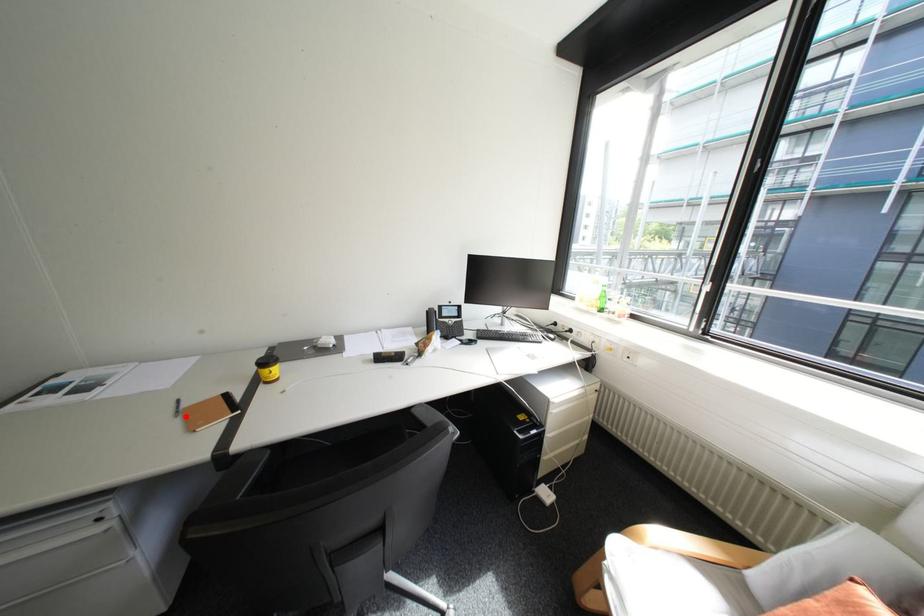
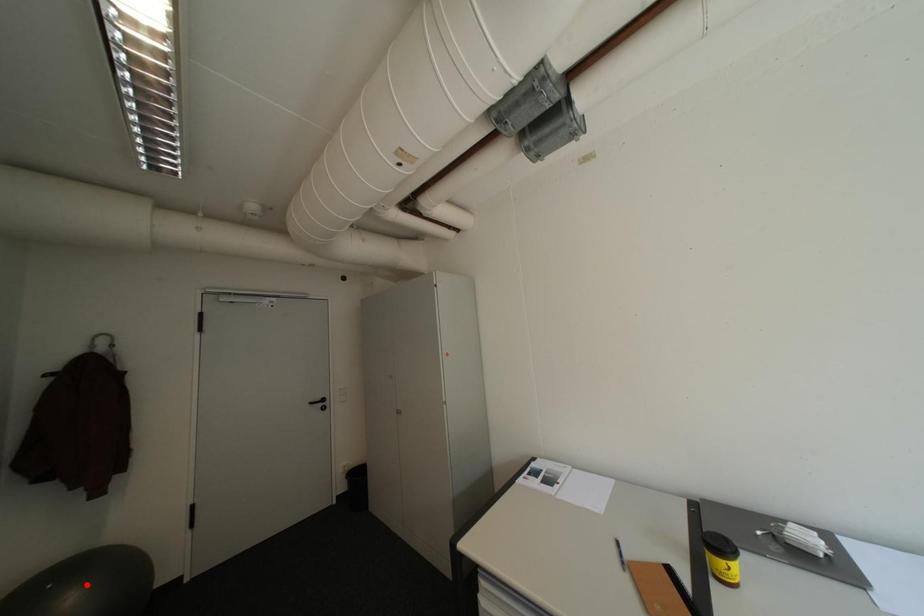
I am providing you with two images of the same scene from different viewpoints. A red point is marked on the first image and another point is marked on the second image. Does the point marked in image1 correspond to the same location as the one in image2?

No